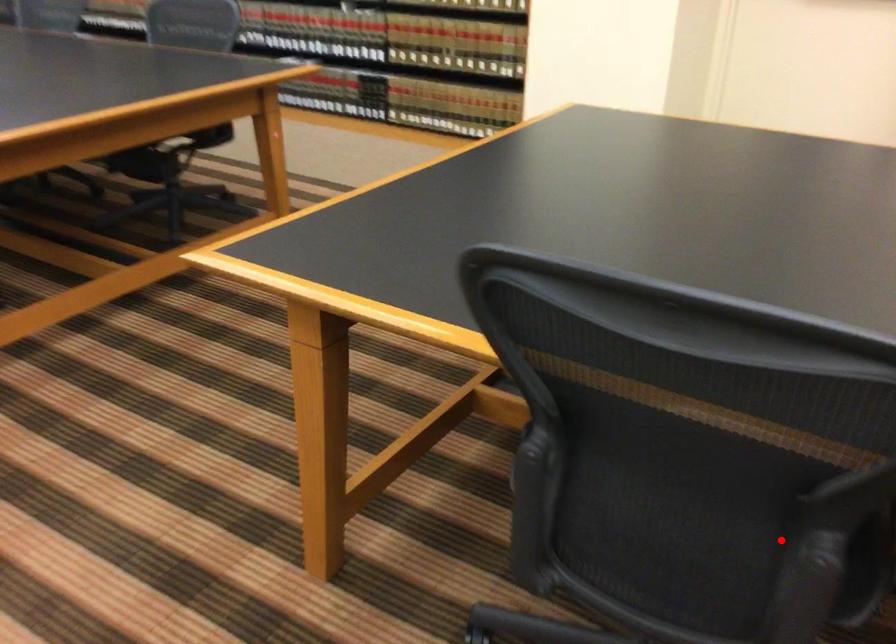
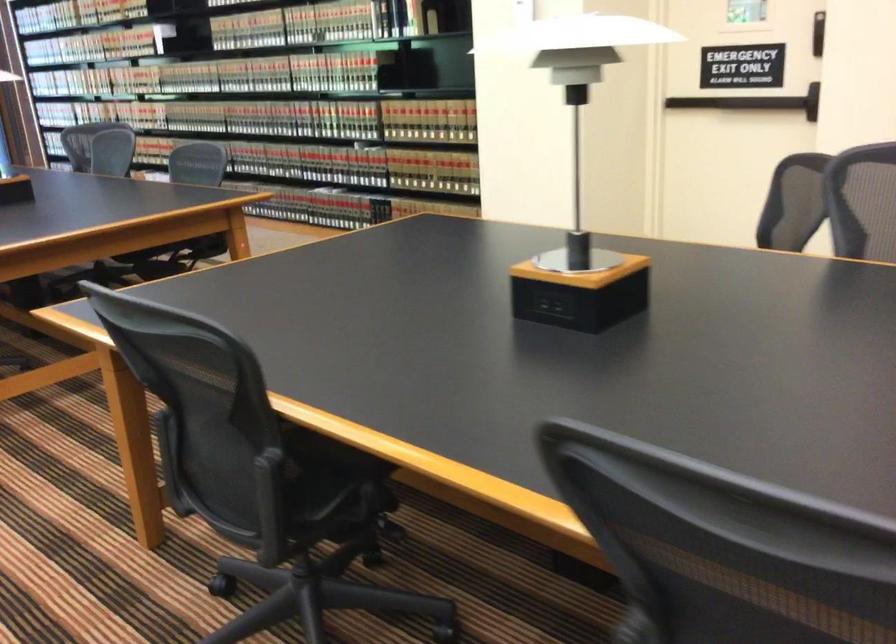
In the second image, find the point that corresponds to the highlighted location in the first image.

(336, 482)